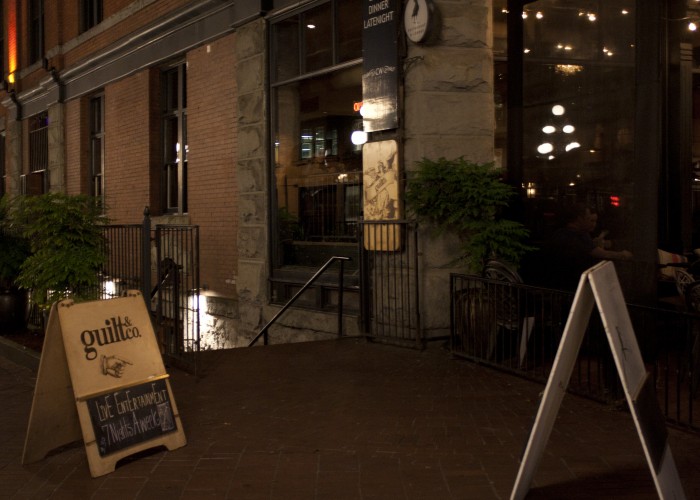
The image size is (700, 500). Find the location of `placard`. placard is located at coordinates (59, 324), (587, 292).